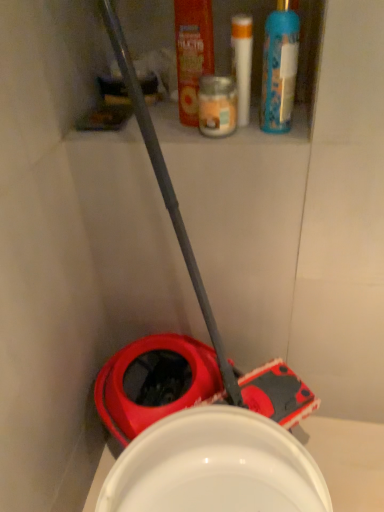
Question: Which direction should I rotate to look at white plastic tube at upper center, which is counted as the second toiletry, starting from the left?

Choices:
 (A) left
 (B) right

Answer: (B)

Question: Is white plastic tube at upper center, which is counted as the second toiletry, starting from the left, not within orange plastic mouthwash at upper center?

Choices:
 (A) no
 (B) yes

Answer: (B)

Question: From the image's perspective, would you say white plastic tube at upper center, the 1th toiletry in the right-to-left sequence, is positioned over orange plastic mouthwash at upper center?

Choices:
 (A) no
 (B) yes

Answer: (A)

Question: Does white plastic tube at upper center, the 1th toiletry in the right-to-left sequence, have a greater width compared to orange plastic mouthwash at upper center?

Choices:
 (A) yes
 (B) no

Answer: (A)

Question: From the image's perspective, is white plastic tube at upper center, the 1th toiletry in the right-to-left sequence, under orange plastic mouthwash at upper center?

Choices:
 (A) yes
 (B) no

Answer: (A)

Question: Is white plastic tube at upper center, the 1th toiletry in the right-to-left sequence, looking in the opposite direction of orange plastic mouthwash at upper center?

Choices:
 (A) no
 (B) yes

Answer: (A)

Question: From a real-world perspective, is white plastic tube at upper center, which is counted as the second toiletry, starting from the left, located beneath orange plastic mouthwash at upper center?

Choices:
 (A) yes
 (B) no

Answer: (A)

Question: From the image's perspective, would you say blue plastic spray bottle at upper right is positioned over translucent glass candle at upper center, the 1th toiletry when ordered from left to right?

Choices:
 (A) no
 (B) yes

Answer: (B)

Question: Is blue plastic spray bottle at upper right behind translucent glass candle at upper center, arranged as the second toiletry when viewed from the right?

Choices:
 (A) no
 (B) yes

Answer: (A)

Question: Are blue plastic spray bottle at upper right and translucent glass candle at upper center, arranged as the second toiletry when viewed from the right, located far from each other?

Choices:
 (A) yes
 (B) no

Answer: (B)

Question: Does blue plastic spray bottle at upper right have a lesser height compared to translucent glass candle at upper center, arranged as the second toiletry when viewed from the right?

Choices:
 (A) yes
 (B) no

Answer: (B)

Question: Does blue plastic spray bottle at upper right turn towards translucent glass candle at upper center, the 1th toiletry when ordered from left to right?

Choices:
 (A) no
 (B) yes

Answer: (A)

Question: Does blue plastic spray bottle at upper right have a greater height compared to translucent glass candle at upper center, the 1th toiletry when ordered from left to right?

Choices:
 (A) no
 (B) yes

Answer: (B)

Question: Is translucent glass candle at upper center, arranged as the second toiletry when viewed from the right, located within white plastic tube at upper center, which is counted as the second toiletry, starting from the left?

Choices:
 (A) no
 (B) yes

Answer: (A)